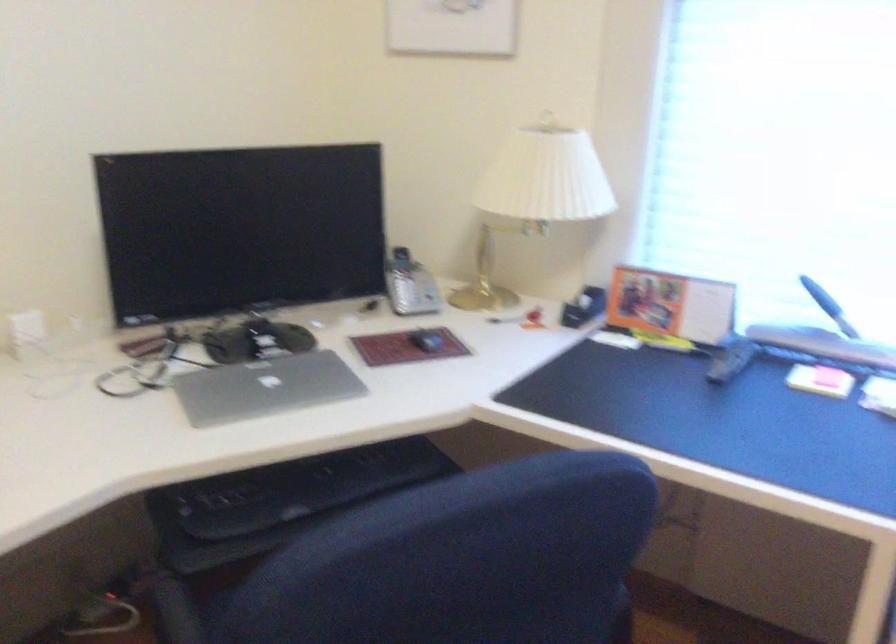
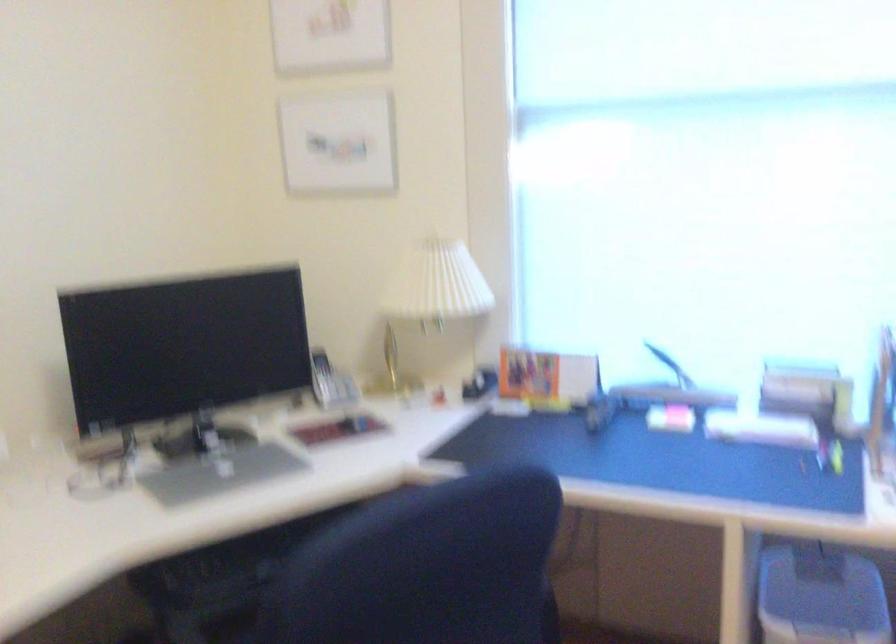
Question: In a continuous first-person perspective shot, in which direction is the camera moving?

Choices:
 (A) Left
 (B) Right
 (C) Forward
 (D) Backward

Answer: (D)